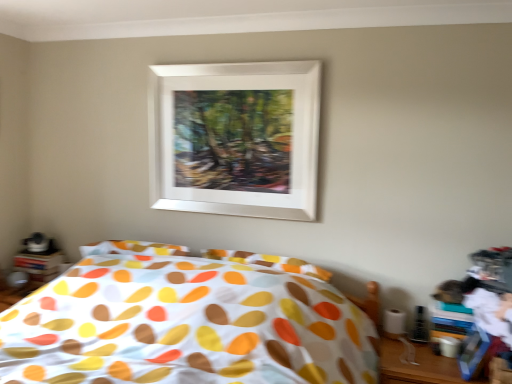
Locate an element on the screen. The image size is (512, 384). white matte picture frame at upper center is located at coordinates (236, 138).

Image resolution: width=512 pixels, height=384 pixels. What do you see at coordinates (418, 365) in the screenshot?
I see `wooden table at lower right` at bounding box center [418, 365].

This screenshot has height=384, width=512. Find the location of `polka dot fabric bed at center`. polka dot fabric bed at center is located at coordinates (185, 325).

Based on the photo, between polka dot fabric bed at center and white matte picture frame at upper center, which one has more height?

white matte picture frame at upper center.

Considering the points (121, 375) and (249, 161), which point is in front, point (121, 375) or point (249, 161)?

The point (121, 375) is closer.

Is polka dot fabric bed at center positioned far away from white matte picture frame at upper center?

polka dot fabric bed at center is actually quite close to white matte picture frame at upper center.

Is polka dot fabric bed at center wider or thinner than white matte picture frame at upper center?

Clearly, polka dot fabric bed at center has more width compared to white matte picture frame at upper center.

Which object is further away from the camera taking this photo, wooden table at lower right or polka dot fabric bed at center?

Positioned behind is wooden table at lower right.

Does wooden table at lower right have a lesser width compared to polka dot fabric bed at center?

Yes.

Looking at the image, does wooden table at lower right seem bigger or smaller compared to polka dot fabric bed at center?

In the image, wooden table at lower right appears to be smaller than polka dot fabric bed at center.

Where is `table below the polka dot fabric bed at center (from a real-world perspective)`? table below the polka dot fabric bed at center (from a real-world perspective) is located at coordinates (418, 365).

Is wooden table at lower right looking in the opposite direction of white matte picture frame at upper center?

No, wooden table at lower right is not facing away from white matte picture frame at upper center.

Is point (449, 368) positioned after point (196, 187)?

No, it is in front of (196, 187).

From a real-world perspective, between wooden table at lower right and white matte picture frame at upper center, who is vertically lower?

From a 3D spatial view, wooden table at lower right is below.

Considering the relative positions of wooden table at lower right and white matte picture frame at upper center in the image provided, is wooden table at lower right to the left of white matte picture frame at upper center from the viewer's perspective?

In fact, wooden table at lower right is to the right of white matte picture frame at upper center.

Which object is further away from the camera, polka dot fabric bed at center or wooden table at lower right?

wooden table at lower right is further from the camera.

Considering the sizes of objects polka dot fabric bed at center and wooden table at lower right in the image provided, who is shorter, polka dot fabric bed at center or wooden table at lower right?

wooden table at lower right.

I want to click on bed in front of the wooden table at lower right, so click(185, 325).

Is polka dot fabric bed at center facing towards wooden table at lower right?

No.

Is white matte picture frame at upper center oriented away from wooden table at lower right?

That's not correct — white matte picture frame at upper center is not looking away from wooden table at lower right.

Would you say white matte picture frame at upper center is inside or outside wooden table at lower right?

white matte picture frame at upper center is outside wooden table at lower right.

Between white matte picture frame at upper center and wooden table at lower right, which one appears on the right side from the viewer's perspective?

wooden table at lower right.

Is white matte picture frame at upper center smaller than wooden table at lower right?

Yes.

Between white matte picture frame at upper center and polka dot fabric bed at center, which one has more height?

white matte picture frame at upper center.

How different are the orientations of white matte picture frame at upper center and polka dot fabric bed at center in degrees?

The angular difference between white matte picture frame at upper center and polka dot fabric bed at center is 0.715 degrees.

Measure the distance from white matte picture frame at upper center to polka dot fabric bed at center.

27.28 inches.

Which of these two, white matte picture frame at upper center or polka dot fabric bed at center, is wider?

polka dot fabric bed at center is wider.

You are a GUI agent. You are given a task and a screenshot of the screen. Output one action in this format:
    pyautogui.click(x=<x>, y=<y>)
    Task: Click on the bed that appears below the white matte picture frame at upper center (from a real-world perspective)
    The width and height of the screenshot is (512, 384).
    Given the screenshot: What is the action you would take?
    pyautogui.click(x=185, y=325)

I want to click on bed lying on the left of wooden table at lower right, so 185,325.

Looking at the image, which one is located further to polka dot fabric bed at center, white matte picture frame at upper center or wooden table at lower right?

Among the two, wooden table at lower right is located further to polka dot fabric bed at center.

Considering their positions, is white matte picture frame at upper center positioned closer to wooden table at lower right than polka dot fabric bed at center?

polka dot fabric bed at center is positioned closer to the anchor wooden table at lower right.

From the image, which object appears to be farther from white matte picture frame at upper center, wooden table at lower right or polka dot fabric bed at center?

The object further to white matte picture frame at upper center is wooden table at lower right.

When comparing their distances from wooden table at lower right, does polka dot fabric bed at center or white matte picture frame at upper center seem further?

white matte picture frame at upper center.

From the image, which object appears to be nearer to polka dot fabric bed at center, wooden table at lower right or white matte picture frame at upper center?

white matte picture frame at upper center is positioned closer to the anchor polka dot fabric bed at center.

From the image, which object appears to be nearer to white matte picture frame at upper center, polka dot fabric bed at center or wooden table at lower right?

Among the two, polka dot fabric bed at center is located nearer to white matte picture frame at upper center.

I want to click on bed between white matte picture frame at upper center and wooden table at lower right from top to bottom, so click(x=185, y=325).